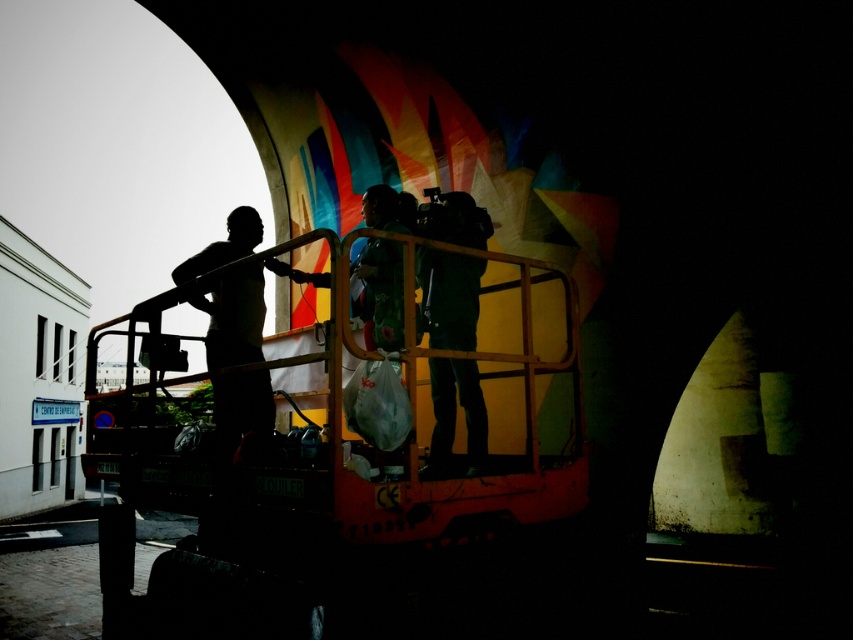
You are an artist standing on the ground looking at the metallic yellow truck at center and the dark green fabric at center. Which object is taller?

The metallic yellow truck at center is taller than the dark green fabric at center.

You are observing two points marked on a mural painting. The first point is at coordinates point (485, 477) and the second is at point (212, 323). Based on the scene description, which point is closer to the observer?

Point (485, 477) is in front of point (212, 323), so it is closer to the observer.

You are standing at the point marked by coordinates point (323, 499) in the image. What object is located at that point?

The point (323, 499) corresponds to the metallic yellow truck at center.